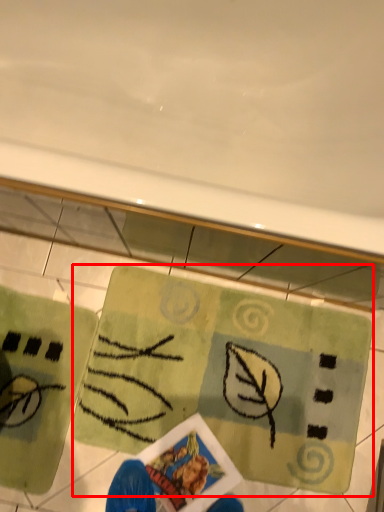
Question: Observing the image, what is the correct spatial positioning of yoga mat (annotated by the red box) in reference to yoga mat?

Choices:
 (A) right
 (B) left

Answer: (A)